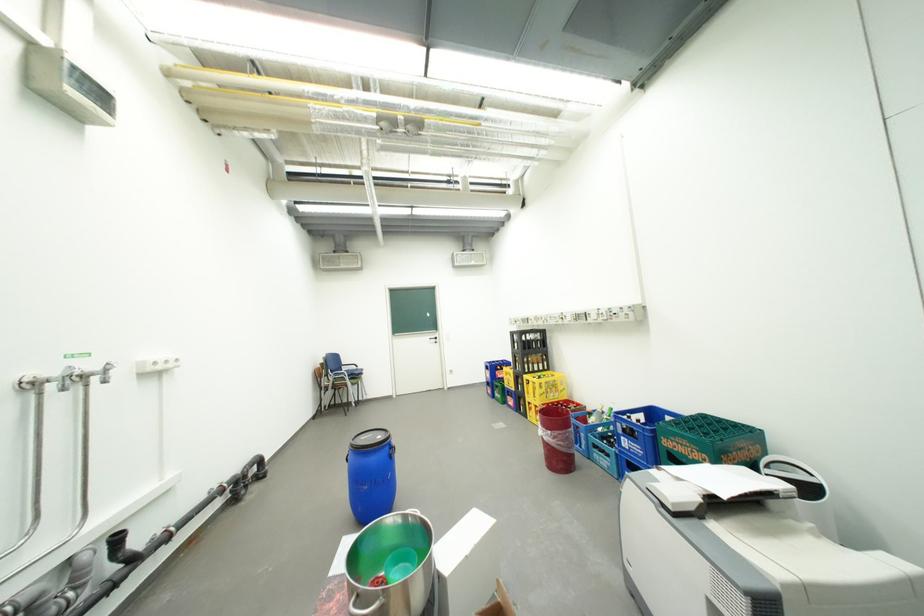
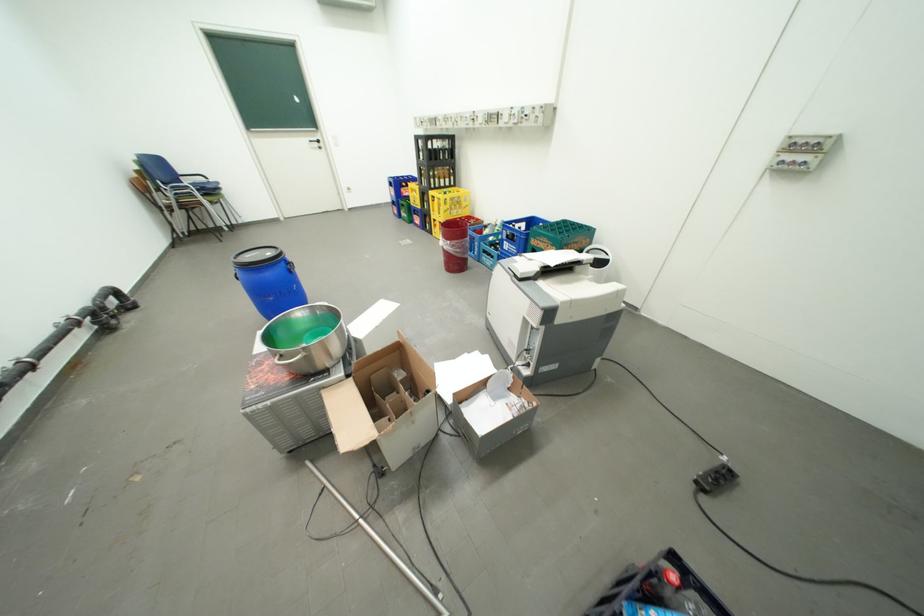
In the second image, find the point that corresponds to pixel 396 447 in the first image.

(290, 262)